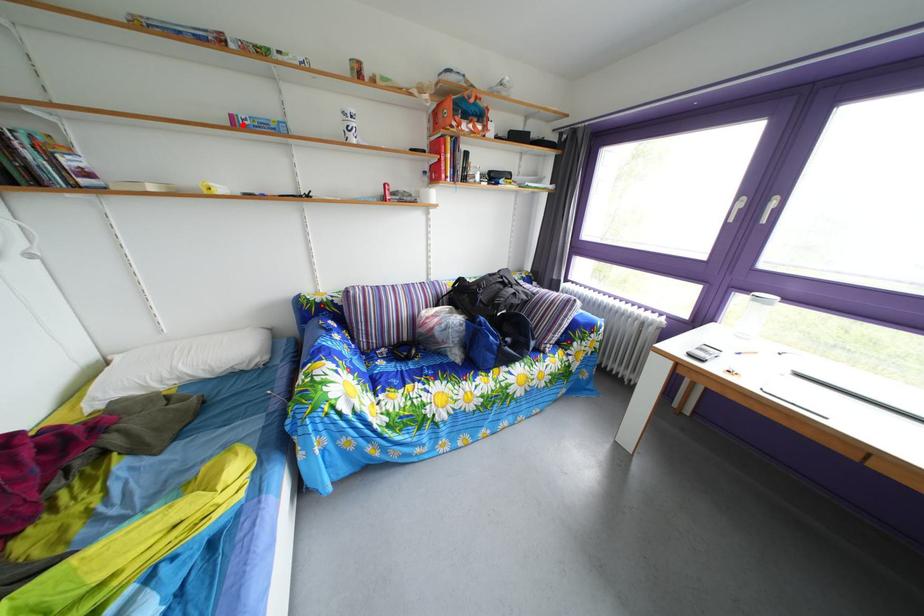
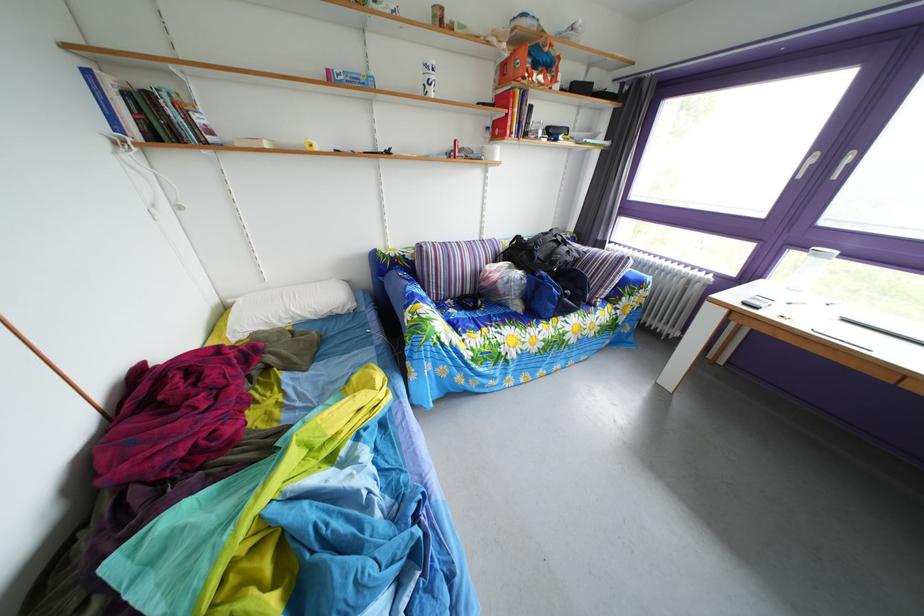
Locate, in the second image, the point that corresponds to the highlighted location in the first image.

(339, 79)